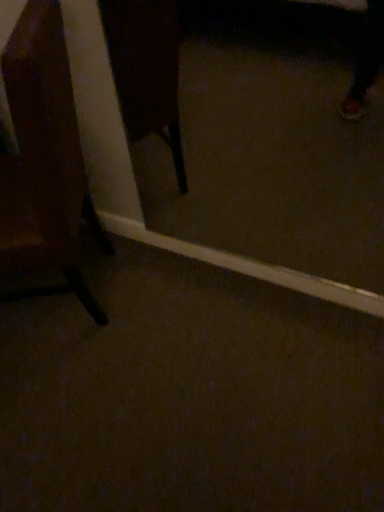
Question: Is wooden chair at left thinner than transparent glass door at center?

Choices:
 (A) yes
 (B) no

Answer: (B)

Question: Does wooden chair at left have a smaller size compared to transparent glass door at center?

Choices:
 (A) yes
 (B) no

Answer: (B)

Question: Are wooden chair at left and transparent glass door at center beside each other?

Choices:
 (A) yes
 (B) no

Answer: (B)

Question: Does wooden chair at left come in front of transparent glass door at center?

Choices:
 (A) yes
 (B) no

Answer: (A)

Question: From the image's perspective, is wooden chair at left located beneath transparent glass door at center?

Choices:
 (A) yes
 (B) no

Answer: (A)

Question: Is wooden chair at left far from transparent glass door at center?

Choices:
 (A) yes
 (B) no

Answer: (A)

Question: Could you tell me if transparent glass door at center is turned towards wooden chair at left?

Choices:
 (A) no
 (B) yes

Answer: (A)

Question: Does transparent glass door at center appear on the right side of wooden chair at left?

Choices:
 (A) yes
 (B) no

Answer: (A)

Question: Is the position of transparent glass door at center more distant than that of wooden chair at left?

Choices:
 (A) no
 (B) yes

Answer: (B)

Question: From a real-world perspective, does transparent glass door at center stand above wooden chair at left?

Choices:
 (A) no
 (B) yes

Answer: (B)

Question: Is transparent glass door at center positioned with its back to wooden chair at left?

Choices:
 (A) no
 (B) yes

Answer: (A)

Question: Can you confirm if transparent glass door at center is wider than wooden chair at left?

Choices:
 (A) yes
 (B) no

Answer: (B)

Question: From the image's perspective, relative to transparent glass door at center, is wooden chair at left above or below?

Choices:
 (A) below
 (B) above

Answer: (A)